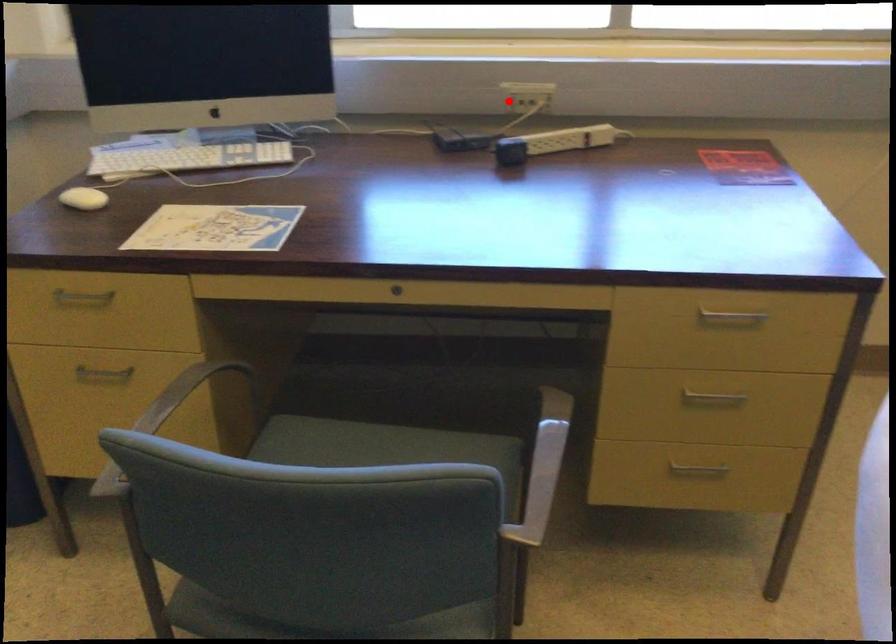
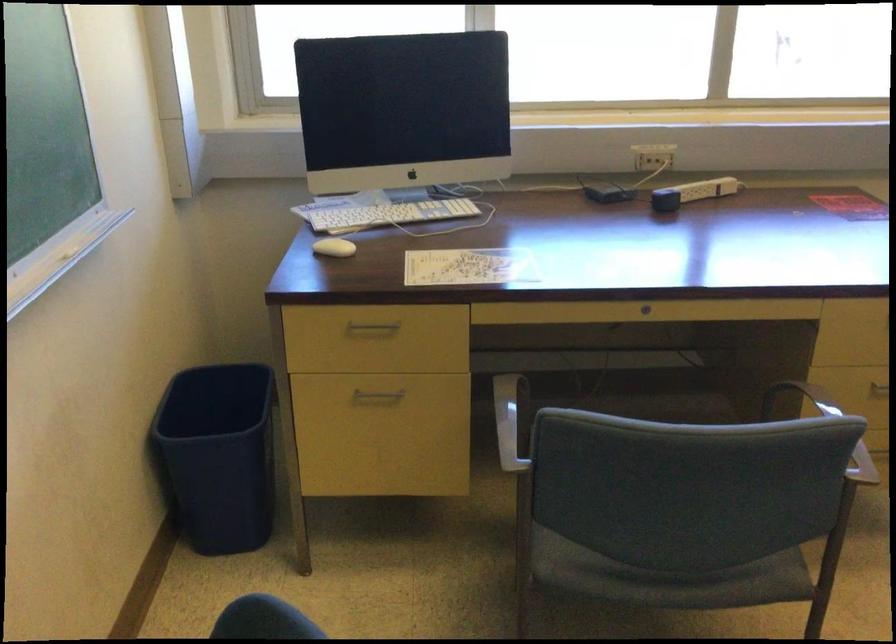
Question: I am providing you with two images of the same scene from different viewpoints. In image1, a red point is highlighted. Considering the same 3D point in image2, which of the following is correct?

Choices:
 (A) It is closer
 (B) It is farther

Answer: (B)